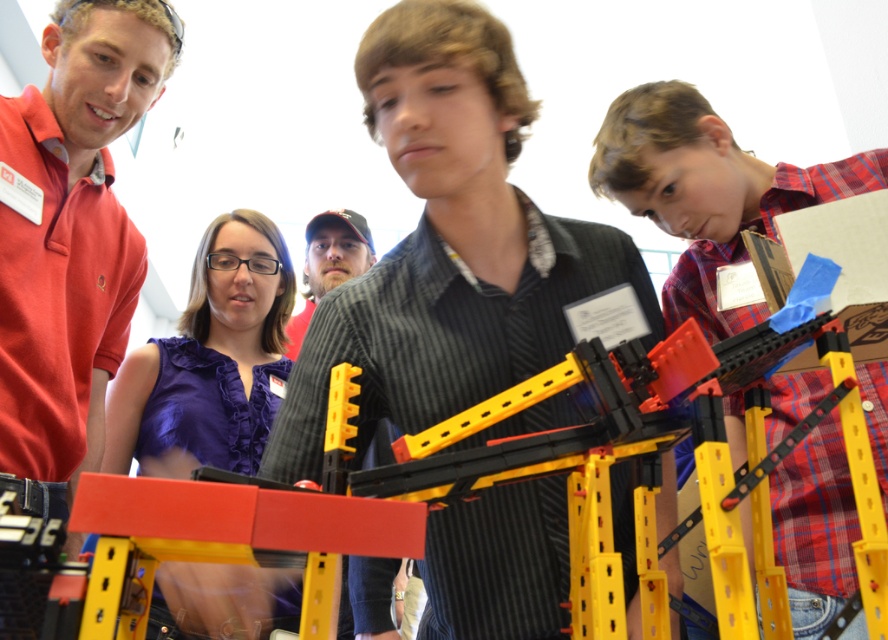
You are a photographer trying to capture a group photo of the matte red shirt at left and the purple fabric shirt at center. Since you want both subjects to appear equally sized in the photo, which subject should you move closer to the camera?

The matte red shirt at left should be moved closer to the camera because its width is smaller than the purple fabric shirt at center, so moving it closer would balance their sizes in the photo.

You are a photographer standing behind the matte red shirt at left and the purple fabric shirt at center. You want to take a photo of the mechanical structure without any people blocking the view. Which person should you move first?

The matte red shirt at left is in front of the purple fabric shirt at center, so you should move the matte red shirt at left first to get an unobstructed view of the mechanical structure.

You are a photographer trying to capture a clear photo of the matte black shirt at center and the matte black cap at center. Since both are in the center, will you need to adjust your camera angle to focus on both?

The matte black shirt at center is wider than the matte black cap at center, so you may need to adjust your camera angle to ensure both are in focus and properly framed.